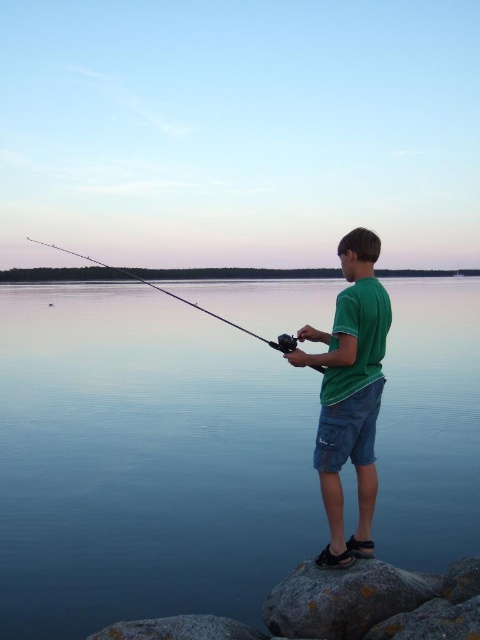
From the picture: You are standing at the point labeled point (256,333) and want to move to the point labeled point (215,636). Which direction should you move to get closer to the destination?

You should move forward because point (215,636) is closer to the viewer than point (256,333), meaning it is in front of you.

You are a hiker who wants to cross the area where the yellowish rock at lower center is located. However, you are carrying a heavy backpack. Is the transparent blue water at center a safer path to take instead?

The transparent blue water at center is located above yellowish rock at lower center, meaning it might be deeper and more stable, making it a safer path for crossing with a heavy backpack compared to the rock which could be slippery or unstable.

You are a photographer trying to capture the silhouette of the green cotton shirt at center and the smooth gray rock at lower center. Which object should you position to the left in your camera frame to align with their actual positions?

The smooth gray rock at lower center should be positioned to the left in your camera frame because the green cotton shirt at center is on its right side.